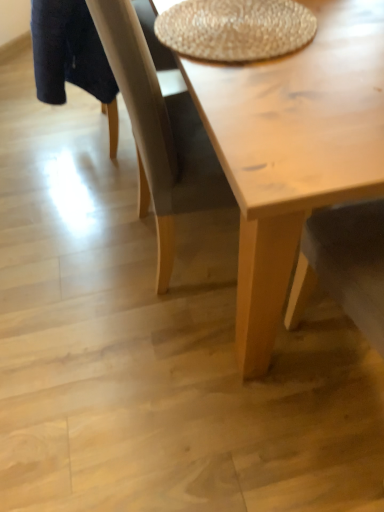
Question: Considering the relative positions of braided straw placemat at upper center and light wood table at center in the image provided, is braided straw placemat at upper center in front of light wood table at center?

Choices:
 (A) yes
 (B) no

Answer: (B)

Question: From the image's perspective, is braided straw placemat at upper center on top of light wood table at center?

Choices:
 (A) yes
 (B) no

Answer: (A)

Question: Does braided straw placemat at upper center contain light wood table at center?

Choices:
 (A) yes
 (B) no

Answer: (B)

Question: Is braided straw placemat at upper center aimed at light wood table at center?

Choices:
 (A) yes
 (B) no

Answer: (A)

Question: Is braided straw placemat at upper center beside light wood table at center?

Choices:
 (A) no
 (B) yes

Answer: (A)

Question: Is braided straw placemat at upper center to the left of light wood table at center from the viewer's perspective?

Choices:
 (A) yes
 (B) no

Answer: (B)

Question: Is light wood table at center positioned with its back to braided straw placemat at upper center?

Choices:
 (A) yes
 (B) no

Answer: (B)

Question: Considering the relative sizes of light wood table at center and braided straw placemat at upper center in the image provided, is light wood table at center wider than braided straw placemat at upper center?

Choices:
 (A) yes
 (B) no

Answer: (A)

Question: Does light wood table at center have a lesser height compared to braided straw placemat at upper center?

Choices:
 (A) yes
 (B) no

Answer: (B)

Question: From a real-world perspective, is light wood table at center positioned over braided straw placemat at upper center based on gravity?

Choices:
 (A) yes
 (B) no

Answer: (B)

Question: From the image's perspective, is light wood table at center on braided straw placemat at upper center?

Choices:
 (A) no
 (B) yes

Answer: (A)

Question: From a real-world perspective, is light wood table at center below braided straw placemat at upper center?

Choices:
 (A) yes
 (B) no

Answer: (A)

Question: From their relative heights in the image, would you say braided straw placemat at upper center is taller or shorter than light wood table at center?

Choices:
 (A) tall
 (B) short

Answer: (B)